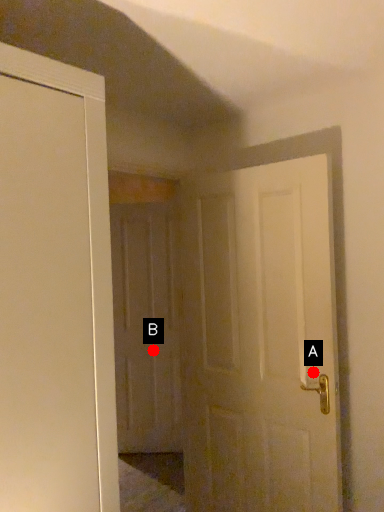
Question: Two points are circled on the image, labeled by A and B beside each circle. Which point appears closest to the camera in this image?

Choices:
 (A) A is closer
 (B) B is closer

Answer: (A)